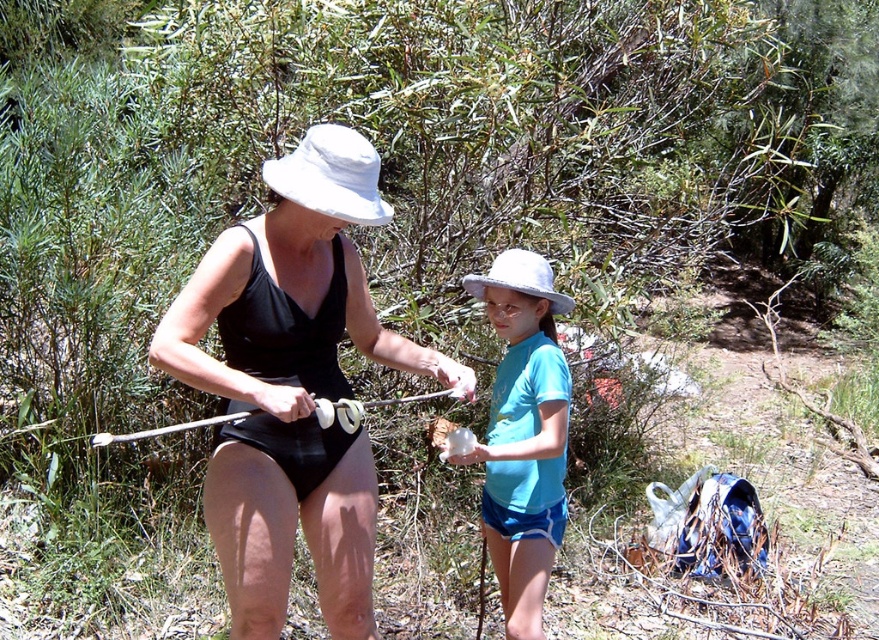
You are planning to place a small decoration between the white fabric hat at upper center and the white matte hat at center. Which hat should the decoration be closer to if you want it to be near the taller one?

The decoration should be closer to the white fabric hat at upper center because it is taller than the white matte hat at center.

You are standing in the forest scene described. There is a white fabric hat at upper center. Where exactly is the white fabric hat located in terms of coordinates?

The white fabric hat at upper center is located at point (x=331, y=176).

You are standing at the origin point of the coordinate system. You want to walk to the blue cotton shirt at center. In which direction should you walk?

The blue cotton shirt at center is located at coordinate point 0.680 on the x axis and 0.596 on the y axis. Since both coordinates are positive, you should walk northeast to reach it.